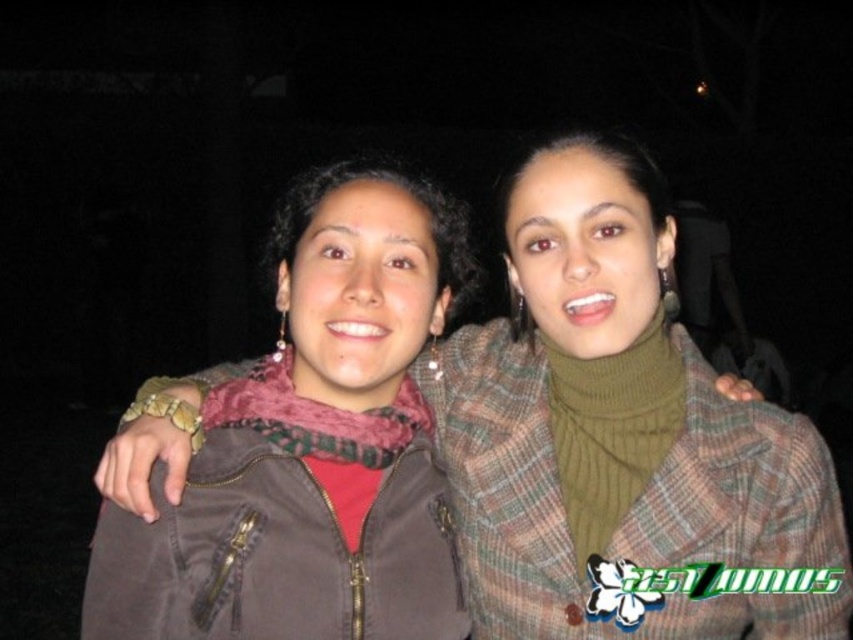
Question: Which object appears farthest from the camera in this image?

Choices:
 (A) brown matte jacket at center
 (B) matte brown jacket at center

Answer: (B)

Question: Is matte brown jacket at center below brown matte jacket at center?

Choices:
 (A) no
 (B) yes

Answer: (B)

Question: Can you confirm if matte brown jacket at center is positioned below brown matte jacket at center?

Choices:
 (A) no
 (B) yes

Answer: (B)

Question: Which of the following is the closest to the observer?

Choices:
 (A) matte brown jacket at center
 (B) brown matte jacket at center

Answer: (B)

Question: Is matte brown jacket at center positioned before brown matte jacket at center?

Choices:
 (A) no
 (B) yes

Answer: (A)